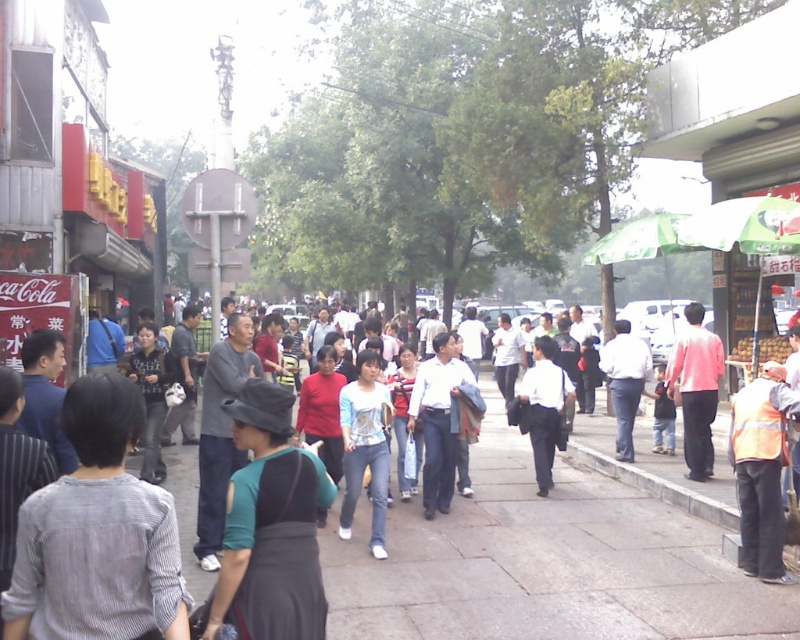
Image resolution: width=800 pixels, height=640 pixels. What do you see at coordinates (366, 448) in the screenshot?
I see `light blue denim jeans at center` at bounding box center [366, 448].

Between point (380, 422) and point (606, 371), which one is positioned in front?

Point (380, 422) is more forward.

You are a GUI agent. You are given a task and a screenshot of the screen. Output one action in this format:
    pyautogui.click(x=<x>, y=<y>)
    Task: Click on the light blue denim jeans at center
    The image size is (800, 640).
    Given the screenshot: What is the action you would take?
    pyautogui.click(x=366, y=448)

Does white cotton shirt at center have a lesser width compared to white shirt at center?

No.

Which is more to the left, white cotton shirt at center or white shirt at center?

Positioned to the left is white cotton shirt at center.

Is point (424, 408) more distant than point (634, 380)?

No, (424, 408) is closer to viewer.

Identify the location of white cotton shirt at center. The height and width of the screenshot is (640, 800). (440, 419).

Who is taller, white smooth shirt at center or white shirt at center?

white shirt at center

Who is more forward, (541, 490) or (636, 403)?

Point (541, 490)

Identify the location of white smooth shirt at center. (544, 406).